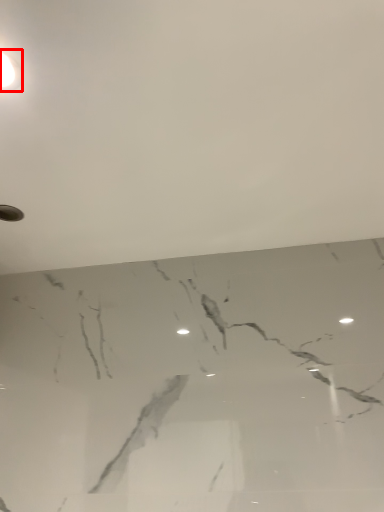
Question: Observing the image, what is the correct spatial positioning of lamp (annotated by the red box) in reference to backdrop?

Choices:
 (A) left
 (B) right

Answer: (A)